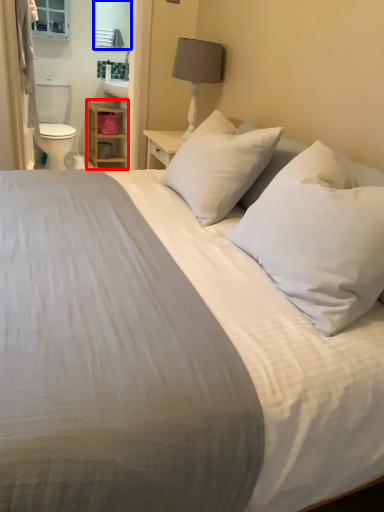
Question: Which point is closer to the camera, dresser (highlighted by a red box) or mirror (highlighted by a blue box)?

Choices:
 (A) dresser
 (B) mirror

Answer: (B)